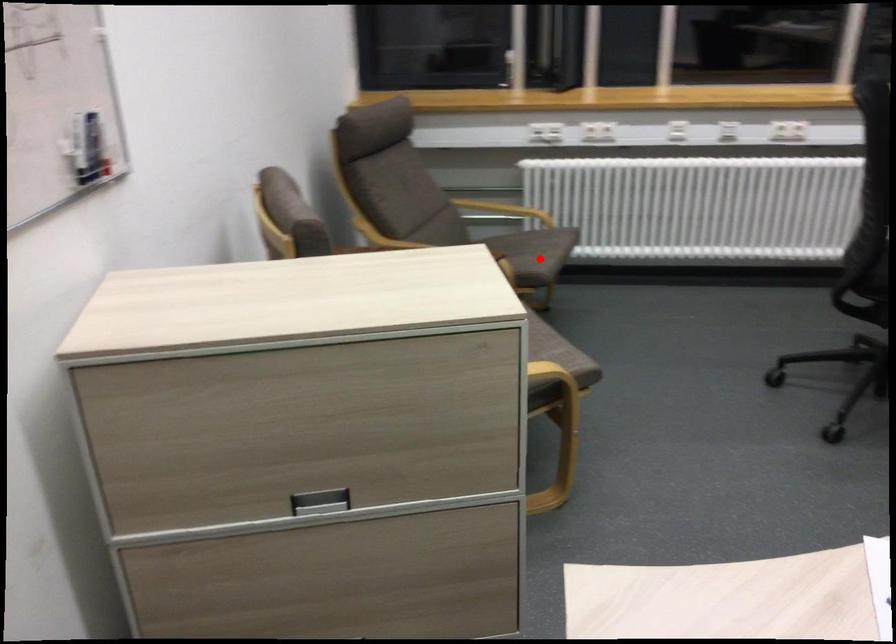
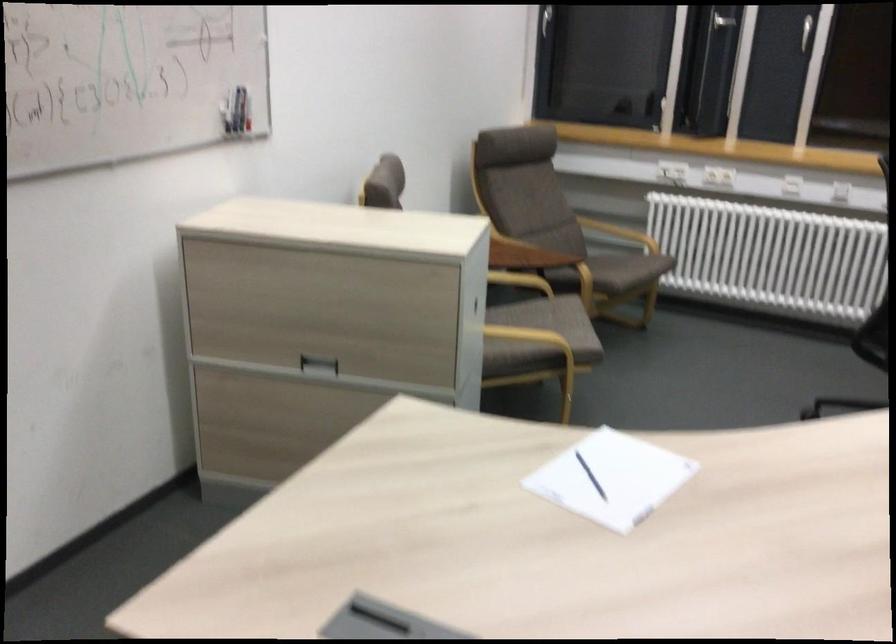
Where in the second image is the point corresponding to the highlighted location from the first image?

(618, 270)